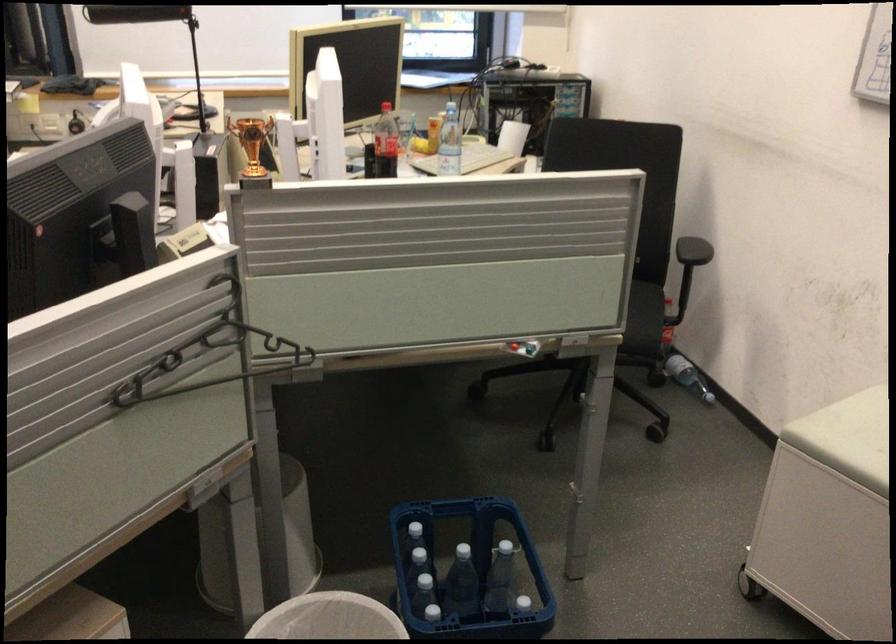
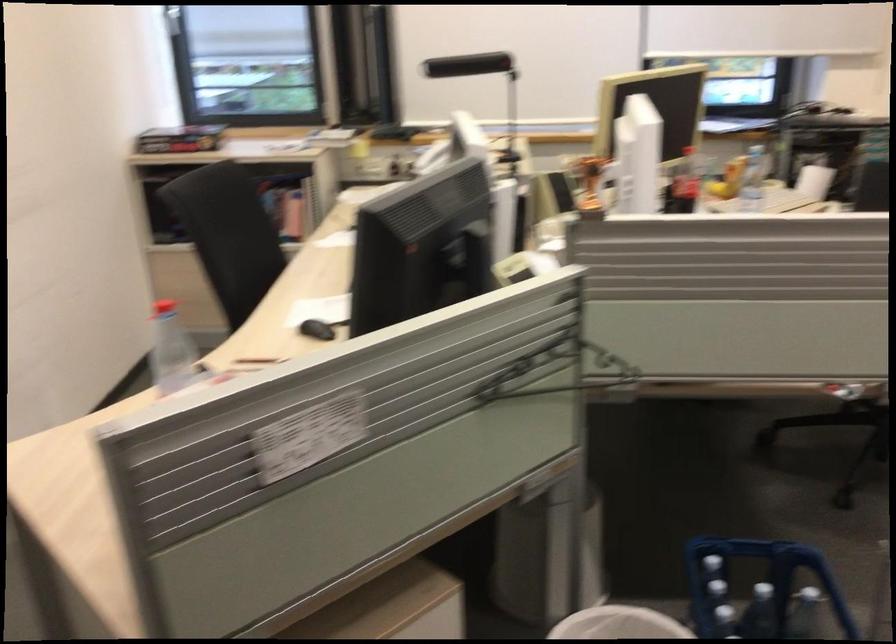
In a continuous first-person perspective shot, in which direction is the camera moving?

The cameraman walked toward left, backward.